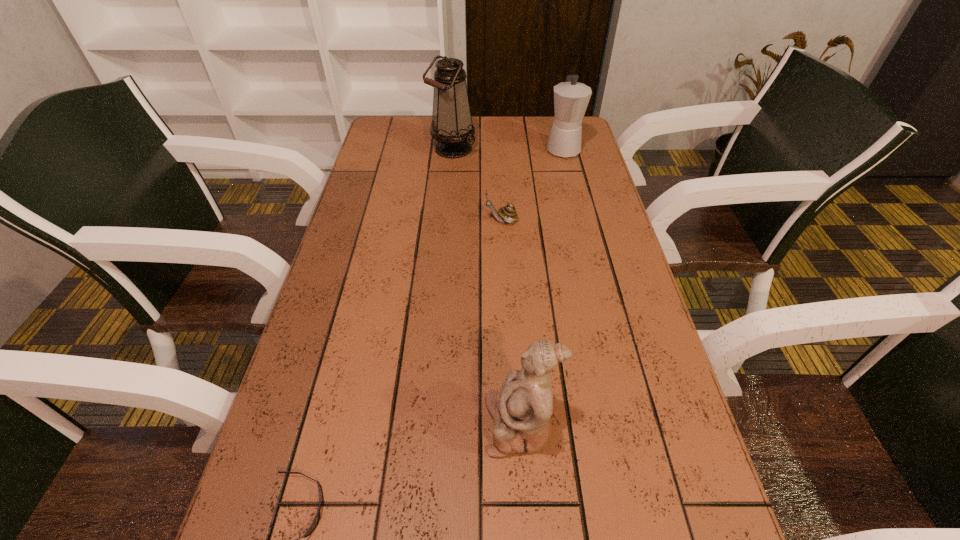
Locate an element on the screen. The width and height of the screenshot is (960, 540). the tallest object is located at coordinates (452, 127).

Where is `the second object from left to right`? The image size is (960, 540). the second object from left to right is located at coordinates (452, 127).

Where is `coffeepot`? coffeepot is located at coordinates (571, 98).

Image resolution: width=960 pixels, height=540 pixels. What are the coordinates of `the fourth farthest object` in the screenshot? It's located at (521, 410).

The image size is (960, 540). I want to click on the second shortest object, so click(x=508, y=213).

At what (x,y) coordinates should I click in order to perform the action: click on the third farthest object. Please return your answer as a coordinate pair (x, y). The width and height of the screenshot is (960, 540). Looking at the image, I should click on (508, 213).

Locate an element on the screen. This screenshot has width=960, height=540. vacant area situated on the front of the tallest object is located at coordinates (450, 172).

Find the location of `vacant area situated on the front of the rightmost object`. vacant area situated on the front of the rightmost object is located at coordinates (587, 241).

Where is `free location located 0.120m on the front-facing side of the second nearest object`? This screenshot has width=960, height=540. free location located 0.120m on the front-facing side of the second nearest object is located at coordinates pyautogui.click(x=420, y=425).

What are the coordinates of `free space located 0.280m on the front-facing side of the second nearest object` in the screenshot? It's located at (333, 425).